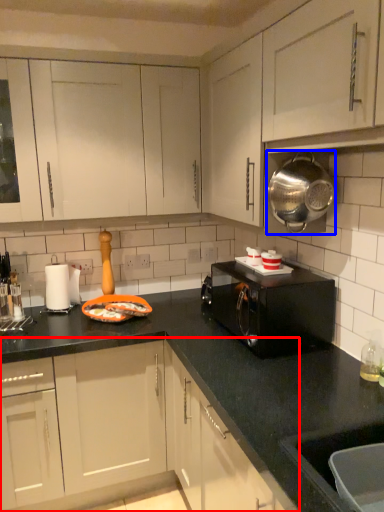
Question: Among these objects, which one is nearest to the camera, cabinetry (highlighted by a red box) or appliance (highlighted by a blue box)?

Choices:
 (A) cabinetry
 (B) appliance

Answer: (B)